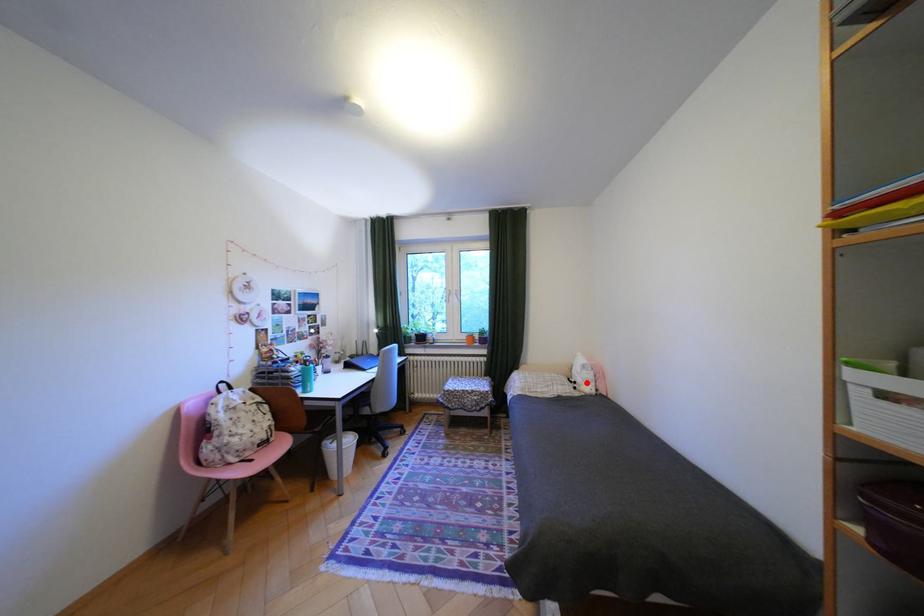
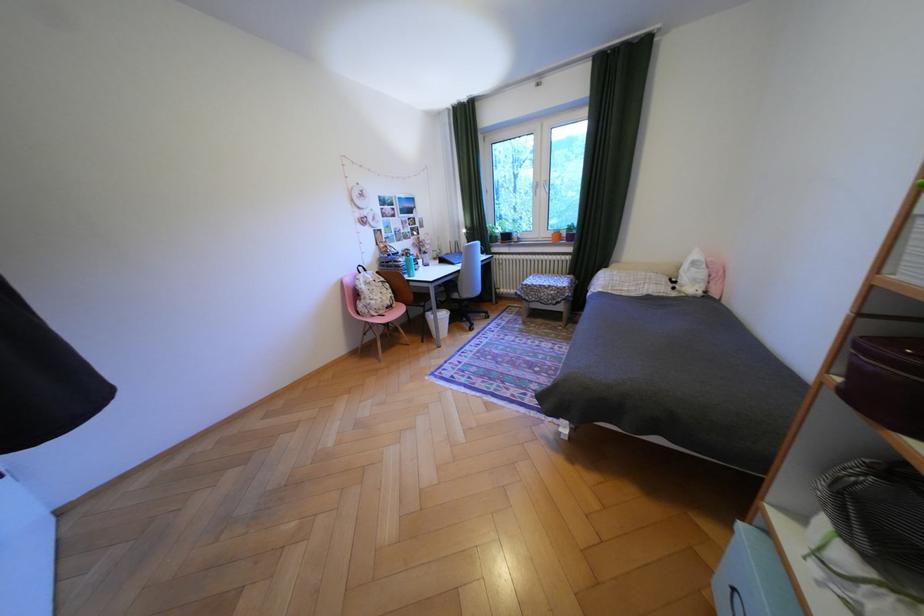
Locate, in the second image, the point that corresponds to the highlighted location in the first image.

(687, 282)